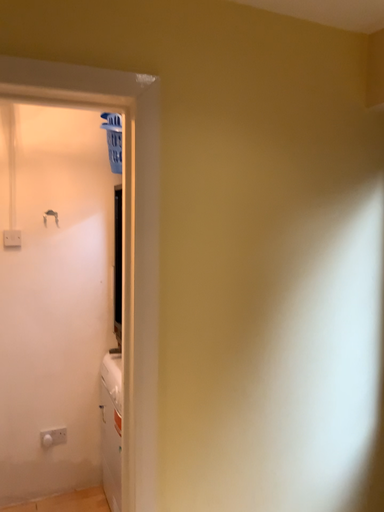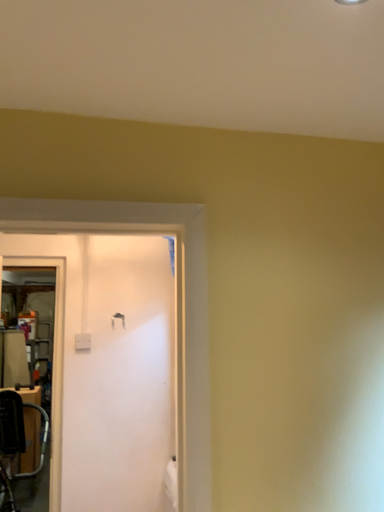
Question: Which way did the camera rotate in the video?

Choices:
 (A) rotated upward
 (B) rotated downward

Answer: (A)